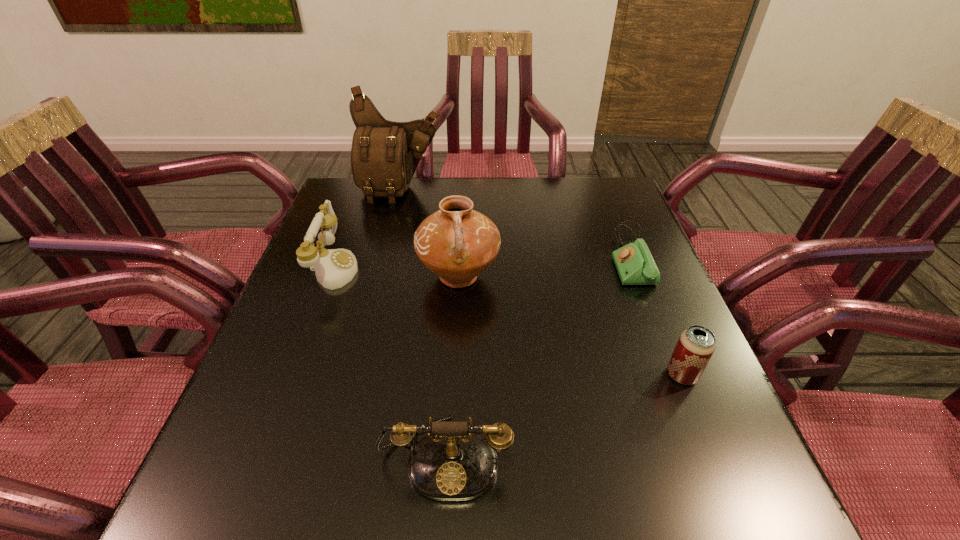
Where is `unoccupied position between the leftmost telephone and the pottery`? Image resolution: width=960 pixels, height=540 pixels. unoccupied position between the leftmost telephone and the pottery is located at coordinates (396, 272).

Locate an element on the screen. empty location between the shoulder bag and the leftmost telephone is located at coordinates (368, 229).

Find the location of a particular element. The height and width of the screenshot is (540, 960). free space between the fifth shortest object and the shortest object is located at coordinates (544, 267).

At what (x,y) coordinates should I click in order to perform the action: click on free space between the second shortest object and the fifth shortest object. Please return your answer as a coordinate pair (x, y). Looking at the image, I should click on (570, 326).

In order to click on vacant region between the second telephone from right to left and the leftmost telephone in this screenshot , I will do `click(390, 362)`.

I want to click on free space that is in between the farthest object and the second telephone from right to left, so 423,323.

Find the location of a particular element. empty space that is in between the second tallest object and the leftmost telephone is located at coordinates (396, 272).

In order to click on vacant region between the farthest object and the leftmost telephone in this screenshot , I will do [x=368, y=229].

I want to click on free space between the fifth tallest object and the leftmost telephone, so click(508, 321).

Identify which object is located as the fourth nearest to the rightmost telephone. Please provide its 2D coordinates. Your answer should be formatted as a tuple, i.e. [(x, y)], where the tuple contains the x and y coordinates of a point satisfying the conditions above.

[(384, 156)]